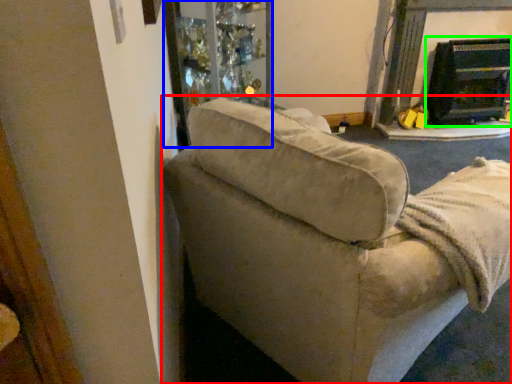
Question: Estimate the real-world distances between objects in this image. Which object is farther from studio couch (highlighted by a red box), glass door (highlighted by a blue box) or fireplace (highlighted by a green box)?

Choices:
 (A) glass door
 (B) fireplace

Answer: (B)